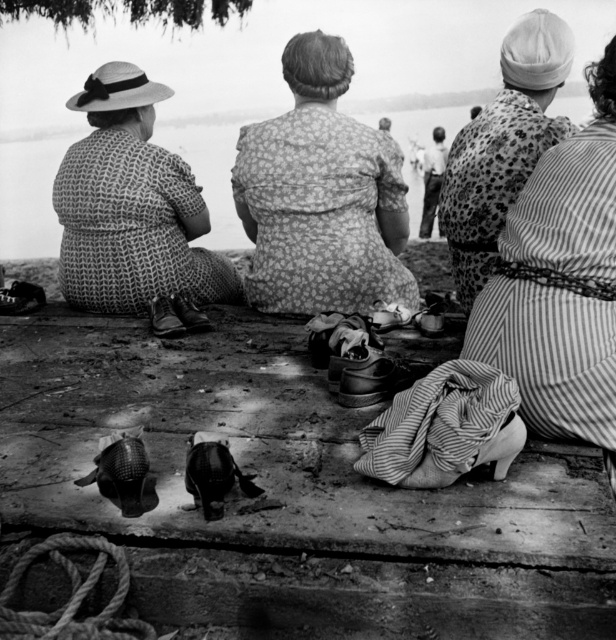
You are a photographer analyzing this black and white photo. You notice the woven fabric hat at left and the smooth water at center. Which object is positioned lower in the image?

The woven fabric hat at left is below smooth water at center, so the woven fabric hat at left is positioned lower in the image.

You are a photographer trying to capture a group photo of the floral fabric dress at center and the smooth skin man at center. Based on their sizes, which one should you position closer to the camera to make them appear the same size in the photo?

The floral fabric dress at center is smaller than the smooth skin man at center, so to make them appear the same size in the photo, you should position the floral fabric dress at center closer to the camera.